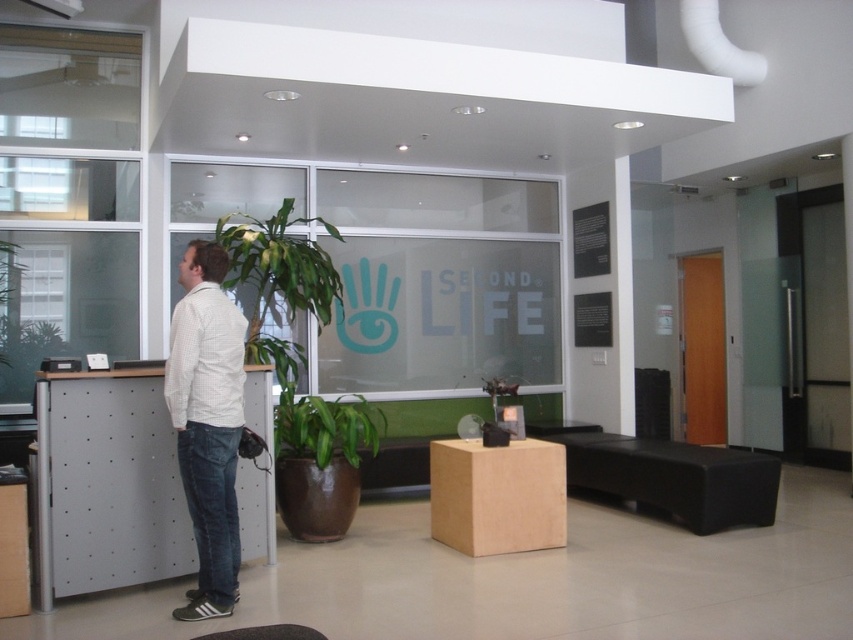
Is white checkered shirt at left taller than green glossy plant at center?

Yes.

Who is more forward, (235, 412) or (283, 397)?

Positioned in front is point (235, 412).

This screenshot has height=640, width=853. What are the coordinates of `white checkered shirt at left` in the screenshot? It's located at (207, 422).

Where is `white checkered shirt at left`? white checkered shirt at left is located at coordinates (207, 422).

Is white checkered shirt at left above black leather stool at lower center?

Correct, white checkered shirt at left is located above black leather stool at lower center.

How much distance is there between white checkered shirt at left and black leather stool at lower center?

A distance of 1.80 meters exists between white checkered shirt at left and black leather stool at lower center.

At what (x,y) coordinates should I click in order to perform the action: click on white checkered shirt at left. Please return your answer as a coordinate pair (x, y). The height and width of the screenshot is (640, 853). Looking at the image, I should click on (207, 422).

Locate an element on the screen. The image size is (853, 640). white checkered shirt at left is located at coordinates (207, 422).

Consider the image. Who is shorter, green glossy plant at center or black leather stool at lower center?

black leather stool at lower center is shorter.

Is green glossy plant at center further to the viewer compared to black leather stool at lower center?

Yes, it is.

Between point (357, 456) and point (209, 637), which one is positioned in front?

Positioned in front is point (209, 637).

In order to click on green glossy plant at center in this screenshot , I will do `click(325, 428)`.